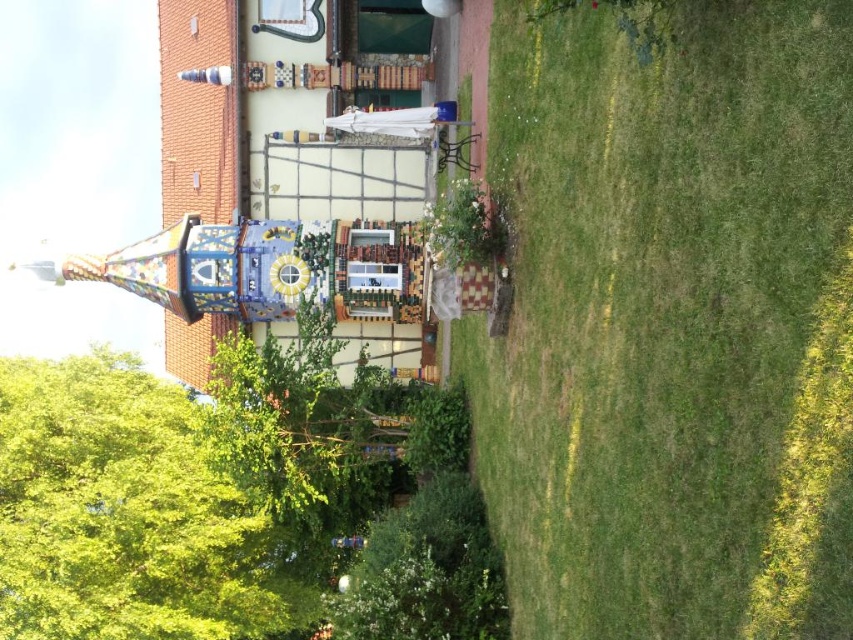
Question: Which point appears closest to the camera in this image?

Choices:
 (A) (103, 508)
 (B) (776, 348)

Answer: (B)

Question: Which point is farther to the camera?

Choices:
 (A) green grass at lower right
 (B) green leafy tree at left

Answer: (B)

Question: Does green grass at lower right come in front of green leafy tree at left?

Choices:
 (A) no
 (B) yes

Answer: (B)

Question: Considering the relative positions of green grass at lower right and green leafy tree at left in the image provided, where is green grass at lower right located with respect to green leafy tree at left?

Choices:
 (A) right
 (B) left

Answer: (A)

Question: Which object appears closest to the camera in this image?

Choices:
 (A) green leafy tree at left
 (B) green grass at lower right

Answer: (B)

Question: Is green grass at lower right wider than green leafy tree at left?

Choices:
 (A) yes
 (B) no

Answer: (B)